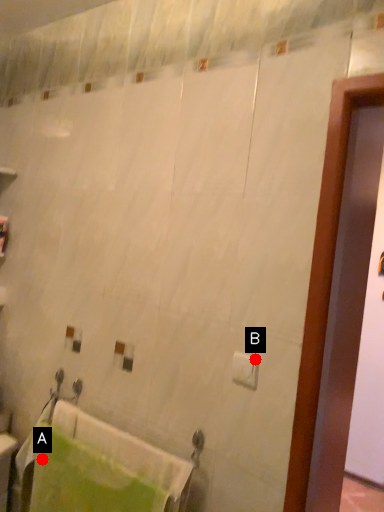
Question: Two points are circled on the image, labeled by A and B beside each circle. Among these points, which one is nearest to the camera?

Choices:
 (A) A is closer
 (B) B is closer

Answer: (B)